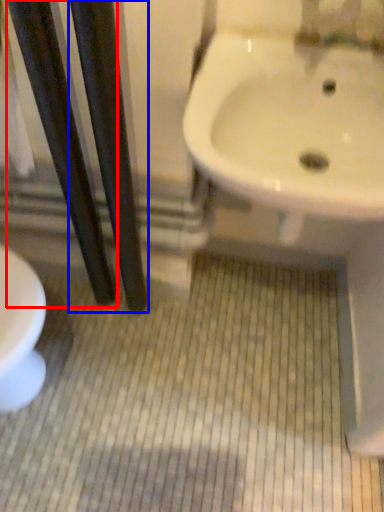
Question: Which point is closer to the camera, pole (highlighted by a red box) or pole (highlighted by a blue box)?

Choices:
 (A) pole
 (B) pole

Answer: (B)